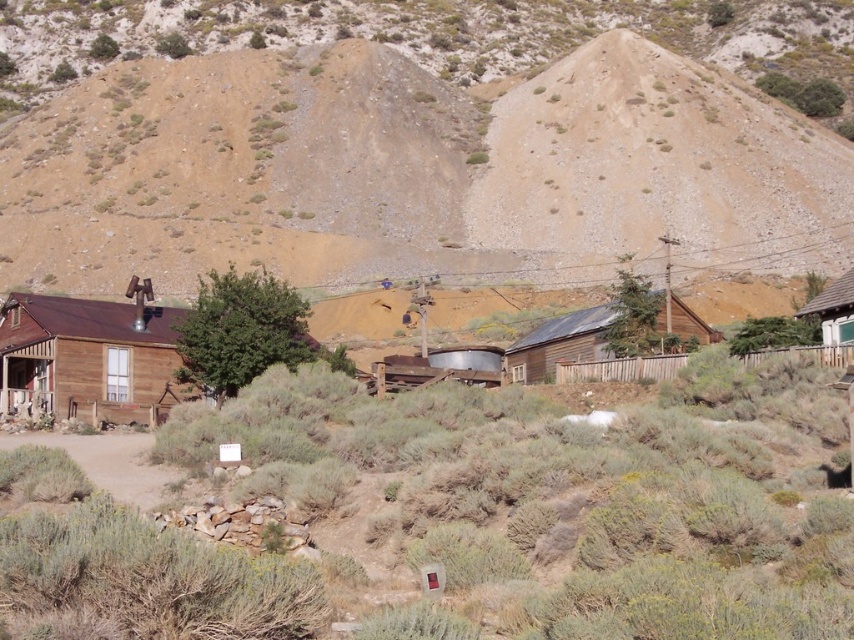
You are a traveler approaching the wooden hut at right and the green leafy tree at center. Which structure will you encounter first as you move forward?

You will encounter the green leafy tree at center first because it is closer to you than the wooden hut at right, which is further away.

You are standing in the abandoned mining town and want to walk from the brown wooden hut at left to the brown wooden hut at center. Which direction should you move relative to the huts?

Since the brown wooden hut at left is closer to the viewer than the brown wooden hut at center, you should move away from the brown wooden hut at left and towards the brown wooden hut at center to reach it.

You are a traveler in this desert mining town and want to find shade. Which object can provide shade, the green leafy tree at center or the brown wooden hut at center?

The green leafy tree at center is positioned over the brown wooden hut at center, so the green leafy tree at center can provide shade over the brown wooden hut at center.